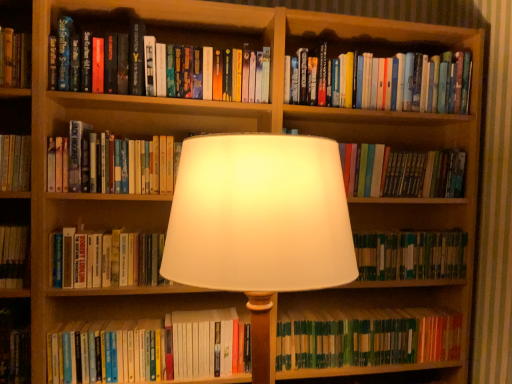
Identify the location of free space above green matte book at lower right, the 8th book positioned from the top (from a real-world perspective). (348, 312).